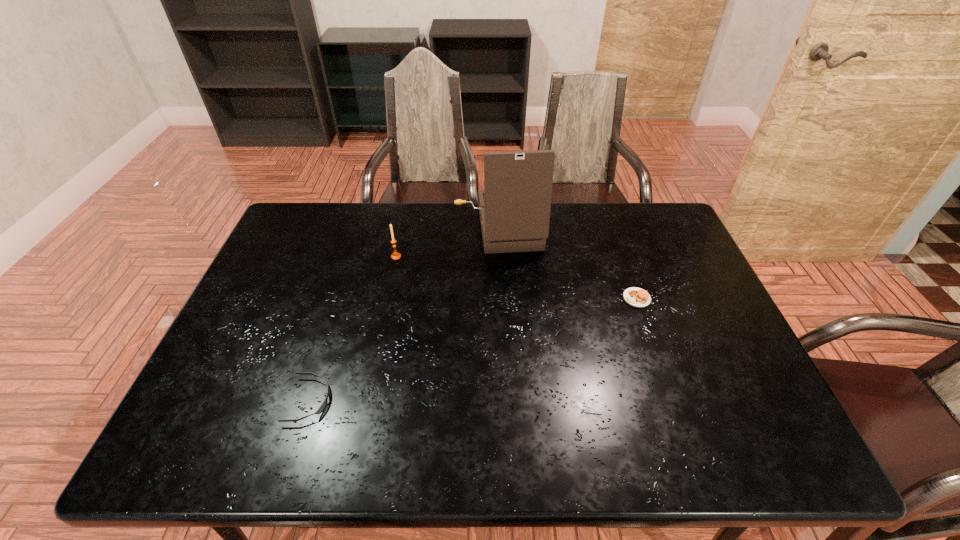
This screenshot has width=960, height=540. I want to click on vacant area situated 0.130m on the right of the third farthest object, so click(x=697, y=298).

Find the location of a particular element. The width and height of the screenshot is (960, 540). vacant region located 0.340m on the front-facing side of the shortest object is located at coordinates (477, 400).

You are a GUI agent. You are given a task and a screenshot of the screen. Output one action in this format:
    pyautogui.click(x=<x>, y=<y>)
    Task: Click on the object situated at the far edge
    Image resolution: width=960 pixels, height=540 pixels.
    Given the screenshot: What is the action you would take?
    pyautogui.click(x=514, y=207)

The image size is (960, 540). I want to click on object that is at the near edge, so click(325, 402).

Find the location of a particular element. vacant area at the far edge of the desktop is located at coordinates (389, 205).

At what (x,y) coordinates should I click in order to perform the action: click on free space at the near edge of the desktop. Please return your answer as a coordinate pair (x, y). This screenshot has height=540, width=960. Looking at the image, I should click on click(693, 462).

Locate an element on the screen. This screenshot has width=960, height=540. blank area at the left edge is located at coordinates (268, 346).

At what (x,y) coordinates should I click in order to perform the action: click on free space at the right edge. Please return your answer as a coordinate pair (x, y). The image size is (960, 540). Looking at the image, I should click on (683, 336).

This screenshot has width=960, height=540. In the image, there is a desktop. Find the location of `vacant space at the far left corner`. vacant space at the far left corner is located at coordinates (292, 231).

Image resolution: width=960 pixels, height=540 pixels. Find the location of `vacant region at the near left corner of the desktop`. vacant region at the near left corner of the desktop is located at coordinates [x=234, y=457].